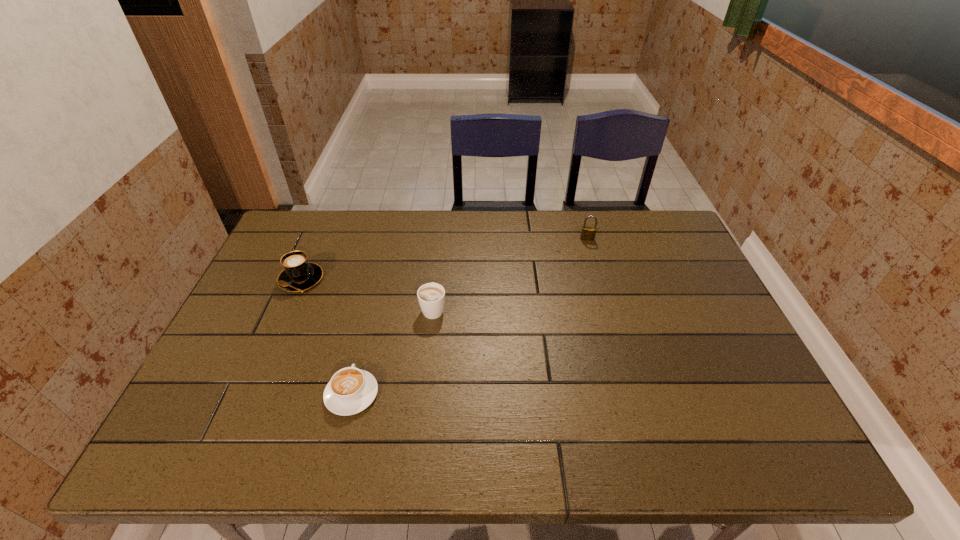
Find the location of `vacant region that satisfies the following two spatial constraints: 1. on the side of the tallest object with the handle; 2. on the right side of the second cappuccino from left to right`. vacant region that satisfies the following two spatial constraints: 1. on the side of the tallest object with the handle; 2. on the right side of the second cappuccino from left to right is located at coordinates (389, 239).

You are a GUI agent. You are given a task and a screenshot of the screen. Output one action in this format:
    pyautogui.click(x=<x>, y=<y>)
    Task: Click on the vacant area in the image that satisfies the following two spatial constraints: 1. on the side of the tallest object with the handle; 2. on the right side of the nearest object
    This screenshot has height=540, width=960.
    Given the screenshot: What is the action you would take?
    pyautogui.click(x=389, y=239)

Where is `free space that satisfies the following two spatial constraints: 1. on the side of the rightmost object with the handle; 2. on the right side of the shortest object`? Image resolution: width=960 pixels, height=540 pixels. free space that satisfies the following two spatial constraints: 1. on the side of the rightmost object with the handle; 2. on the right side of the shortest object is located at coordinates (389, 239).